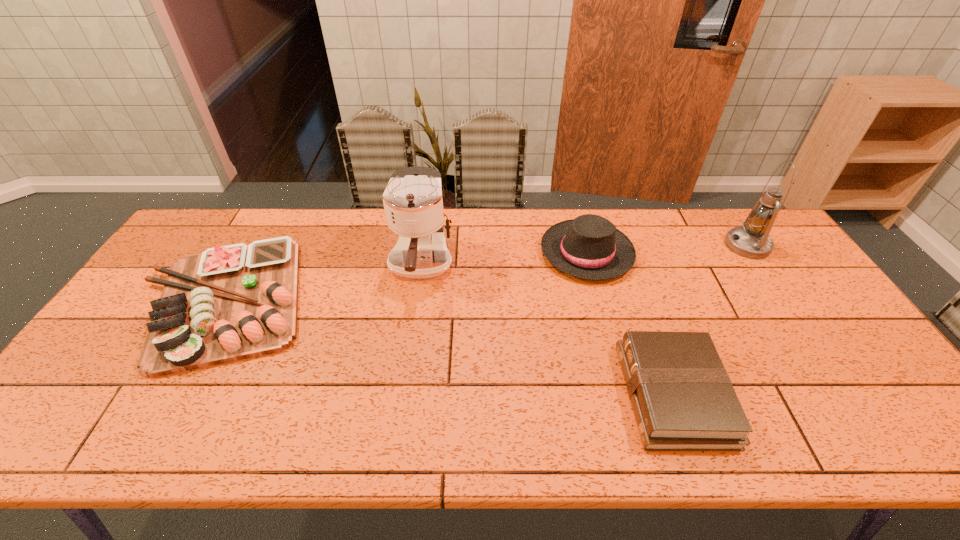
Where is `free spot between the dress hat and the coffee maker`? The height and width of the screenshot is (540, 960). free spot between the dress hat and the coffee maker is located at coordinates (504, 259).

At what (x,y) coordinates should I click in order to perform the action: click on vacant space that is in between the oil lamp and the dress hat. Please return your answer as a coordinate pair (x, y). The width and height of the screenshot is (960, 540). Looking at the image, I should click on (667, 249).

In order to click on free space that is in between the oil lamp and the leftmost object in this screenshot , I will do `click(486, 273)`.

The image size is (960, 540). I want to click on vacant area that lies between the Bible and the platter, so click(x=449, y=347).

Locate an element on the screen. The width and height of the screenshot is (960, 540). vacant space that is in between the Bible and the oil lamp is located at coordinates (710, 320).

You are a GUI agent. You are given a task and a screenshot of the screen. Output one action in this format:
    pyautogui.click(x=<x>, y=<y>)
    Task: Click on the object that stands as the third closest to the rightmost object
    The height and width of the screenshot is (540, 960).
    Given the screenshot: What is the action you would take?
    pyautogui.click(x=413, y=203)

Identify which object is the fourth closest to the third tallest object. Please provide its 2D coordinates. Your answer should be formatted as a tuple, i.e. [(x, y)], where the tuple contains the x and y coordinates of a point satisfying the conditions above.

[(228, 303)]